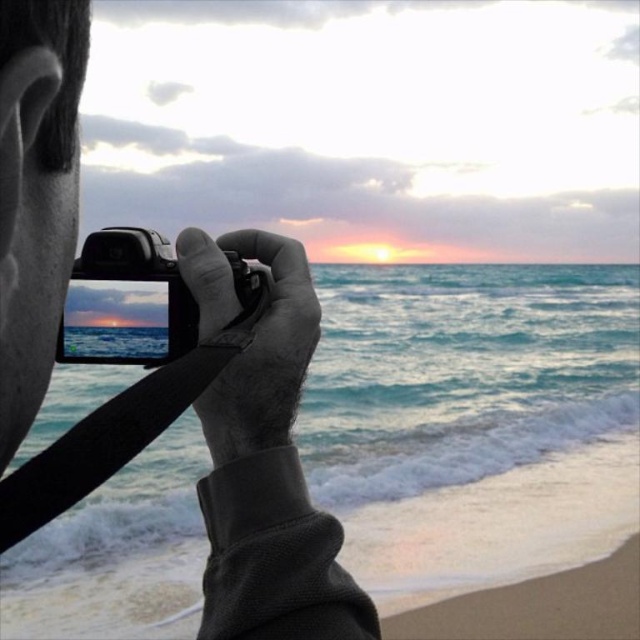
Is matte black camera at center positioned before sandy beach at lower right?

Yes, it is.

Is matte black camera at center wider than sandy beach at lower right?

In fact, matte black camera at center might be narrower than sandy beach at lower right.

Which is behind, point (68, 218) or point (419, 541)?

The point (419, 541) is behind.

Where is `matte black camera at center`? The width and height of the screenshot is (640, 640). matte black camera at center is located at coordinates (262, 456).

Is sandy beach at lower right shorter than black plastic camera at center?

Yes, sandy beach at lower right is shorter than black plastic camera at center.

This screenshot has height=640, width=640. I want to click on sandy beach at lower right, so click(496, 524).

Does point (256, 461) lie in front of point (195, 310)?

Yes, it is.

Who is shorter, matte black camera at center or black plastic camera at center?

black plastic camera at center

Locate an element on the screen. The image size is (640, 640). matte black camera at center is located at coordinates (262, 456).